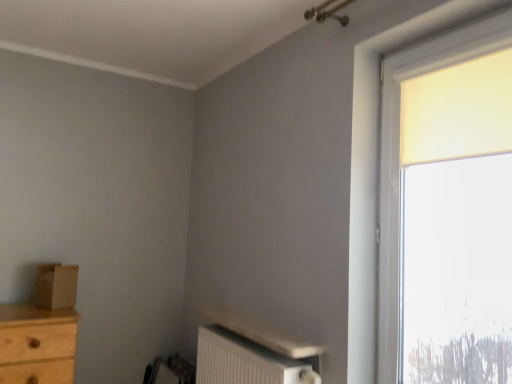
Describe the element at coordinates (56, 286) in the screenshot. I see `brown cardboard box at left` at that location.

This screenshot has width=512, height=384. Describe the element at coordinates (458, 111) in the screenshot. I see `matte yellow curtain at upper right` at that location.

At what (x,y) coordinates should I click in order to perform the action: click on matte yellow curtain at right. Please return your answer as a coordinate pair (x, y). This screenshot has height=384, width=512. Looking at the image, I should click on (399, 159).

From the image's perspective, is matte yellow curtain at right located above or below white textured radiator at lower center?

Based on their image positions, matte yellow curtain at right is located above white textured radiator at lower center.

Based on the photo, is matte yellow curtain at right not inside white textured radiator at lower center?

Yes, matte yellow curtain at right is outside of white textured radiator at lower center.

Considering the positions of point (392, 250) and point (275, 352), is point (392, 250) closer or farther from the camera than point (275, 352)?

Point (392, 250).

Between matte yellow curtain at upper right and white textured radiator at lower center, which one appears on the left side from the viewer's perspective?

white textured radiator at lower center is more to the left.

Could you tell me if matte yellow curtain at upper right is turned towards white textured radiator at lower center?

No, matte yellow curtain at upper right is not facing towards white textured radiator at lower center.

Is matte yellow curtain at upper right directly adjacent to white textured radiator at lower center?

There is a gap between matte yellow curtain at upper right and white textured radiator at lower center.

Does matte yellow curtain at right touch matte yellow curtain at upper right?

No, matte yellow curtain at right is not next to matte yellow curtain at upper right.

Based on their positions, is matte yellow curtain at right located to the left or right of matte yellow curtain at upper right?

matte yellow curtain at right is to the left of matte yellow curtain at upper right.

At what (x,y) coordinates should I click in order to perform the action: click on window below the matte yellow curtain at upper right (from a real-world perspective). Please return your answer as a coordinate pair (x, y). The image size is (512, 384). Looking at the image, I should click on (399, 159).

Is point (434, 51) farther from camera compared to point (38, 273)?

No.

From a real-world perspective, does matte yellow curtain at right stand above brown cardboard box at left?

Yes, from a real-world perspective, matte yellow curtain at right is on top of brown cardboard box at left.

In the scene shown: Is matte yellow curtain at right not near brown cardboard box at left?

Indeed, matte yellow curtain at right is not near brown cardboard box at left.

Can you confirm if matte yellow curtain at right is bigger than brown cardboard box at left?

Correct, matte yellow curtain at right is larger in size than brown cardboard box at left.

Is point (509, 77) farther from camera compared to point (383, 338)?

No, (509, 77) is closer to viewer.

Measure the distance between matte yellow curtain at upper right and matte yellow curtain at right.

16.38 centimeters.

Looking at this image, does matte yellow curtain at upper right have a lesser height compared to matte yellow curtain at right?

Yes.

Is matte yellow curtain at upper right smaller than matte yellow curtain at right?

Yes.

Would you consider brown cardboard box at left to be distant from matte yellow curtain at upper right?

Absolutely, brown cardboard box at left is distant from matte yellow curtain at upper right.

Which is more to the right, brown cardboard box at left or matte yellow curtain at upper right?

matte yellow curtain at upper right is more to the right.

Is brown cardboard box at left thinner than matte yellow curtain at upper right?

Incorrect, the width of brown cardboard box at left is not less than that of matte yellow curtain at upper right.

Considering the relative sizes of brown cardboard box at left and matte yellow curtain at upper right in the image provided, is brown cardboard box at left smaller than matte yellow curtain at upper right?

Correct, brown cardboard box at left occupies less space than matte yellow curtain at upper right.

Is white textured radiator at lower center inside or outside of matte yellow curtain at upper right?

white textured radiator at lower center is not inside matte yellow curtain at upper right, it's outside.

How much distance is there between white textured radiator at lower center and matte yellow curtain at upper right?

white textured radiator at lower center and matte yellow curtain at upper right are 1.14 meters apart.

Where is `radiator below the matte yellow curtain at upper right (from a real-world perspective)`? The height and width of the screenshot is (384, 512). radiator below the matte yellow curtain at upper right (from a real-world perspective) is located at coordinates (245, 361).

Which of these two, white textured radiator at lower center or matte yellow curtain at upper right, stands taller?

matte yellow curtain at upper right is taller.

You are a GUI agent. You are given a task and a screenshot of the screen. Output one action in this format:
    pyautogui.click(x=<x>, y=<y>)
    Task: Click on the radiator behind the matte yellow curtain at right
    This screenshot has height=384, width=512.
    Given the screenshot: What is the action you would take?
    pyautogui.click(x=245, y=361)

I want to click on curtain on the right of white textured radiator at lower center, so click(458, 111).

Estimate the real-world distances between objects in this image. Which object is closer to matte yellow curtain at right, brown cardboard box at left or matte yellow curtain at upper right?

The object closer to matte yellow curtain at right is matte yellow curtain at upper right.

When comparing their distances from matte yellow curtain at right, does matte yellow curtain at upper right or white textured radiator at lower center seem further?

white textured radiator at lower center lies further to matte yellow curtain at right than the other object.

Considering their positions, is white textured radiator at lower center positioned closer to brown cardboard box at left than matte yellow curtain at upper right?

white textured radiator at lower center lies closer to brown cardboard box at left than the other object.

Based on their spatial positions, is brown cardboard box at left or matte yellow curtain at right closer to matte yellow curtain at upper right?

The object closer to matte yellow curtain at upper right is matte yellow curtain at right.

Looking at this image, looking at the image, which one is located further to brown cardboard box at left, matte yellow curtain at right or matte yellow curtain at upper right?

matte yellow curtain at upper right is positioned further to the anchor brown cardboard box at left.

Considering their positions, is matte yellow curtain at upper right positioned further to brown cardboard box at left than white textured radiator at lower center?

matte yellow curtain at upper right lies further to brown cardboard box at left than the other object.

Considering their positions, is white textured radiator at lower center positioned further to matte yellow curtain at upper right than matte yellow curtain at right?

white textured radiator at lower center.

Based on their spatial positions, is matte yellow curtain at right or white textured radiator at lower center further from brown cardboard box at left?

matte yellow curtain at right is positioned further to the anchor brown cardboard box at left.

Locate an element on the screen. The image size is (512, 384). window between matte yellow curtain at upper right and white textured radiator at lower center vertically is located at coordinates (399, 159).

In order to click on radiator between brown cardboard box at left and matte yellow curtain at right from left to right in this screenshot , I will do `click(245, 361)`.

At what (x,y) coordinates should I click in order to perform the action: click on window located between brown cardboard box at left and matte yellow curtain at upper right in the left-right direction. Please return your answer as a coordinate pair (x, y). Looking at the image, I should click on pyautogui.click(x=399, y=159).

The height and width of the screenshot is (384, 512). Identify the location of radiator located between brown cardboard box at left and matte yellow curtain at upper right in the left-right direction. (245, 361).